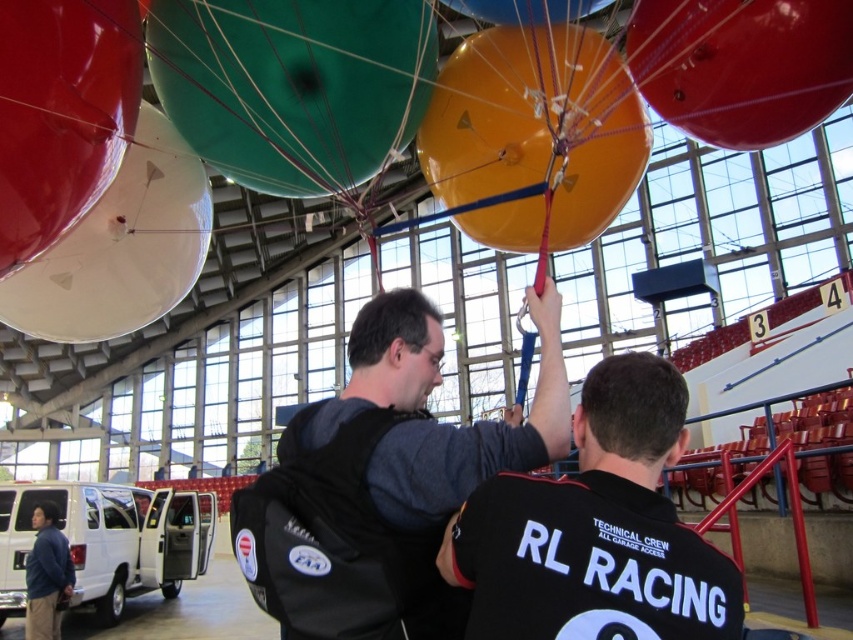
You are a delivery person who needs to carry both the black fabric backpack at center and the shiny red balloon at upper right. Which item will take up more space in your delivery van?

The black fabric backpack at center has a larger size compared to the shiny red balloon at upper right, so it will take up more space in the delivery van.

You are standing in the room where the shiny red balloon at upper right and the blue fabric jacket at lower left are present. Which object is positioned higher from the ground?

The shiny red balloon at upper right is located above the blue fabric jacket at lower left, so it is higher from the ground.